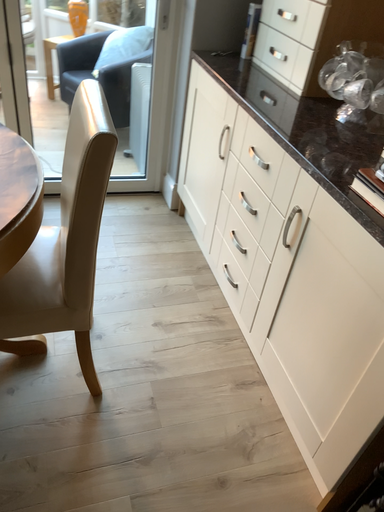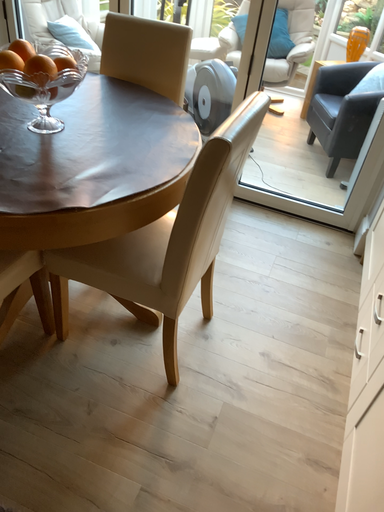
Question: Which way did the camera rotate in the video?

Choices:
 (A) rotated left
 (B) rotated right

Answer: (A)